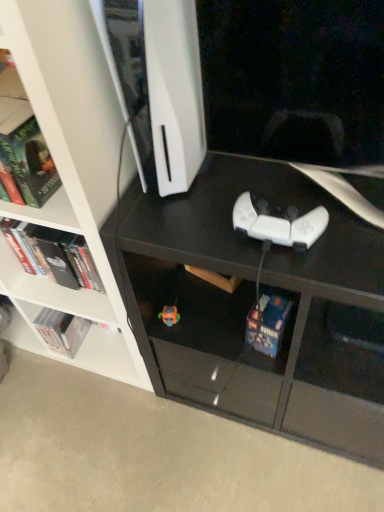
Question: Is hardcover book at lower center, arranged as the first book when viewed from the front, placed right next to translucent orange toy at lower center?

Choices:
 (A) no
 (B) yes

Answer: (A)

Question: Is hardcover book at lower center, which is counted as the third book, starting from the left, bigger than translucent orange toy at lower center?

Choices:
 (A) no
 (B) yes

Answer: (B)

Question: Is hardcover book at lower center, marked as the 3th book in a back-to-front arrangement, located outside translucent orange toy at lower center?

Choices:
 (A) yes
 (B) no

Answer: (A)

Question: From the image's perspective, does hardcover book at lower center, arranged as the first book when viewed from the front, appear lower than translucent orange toy at lower center?

Choices:
 (A) yes
 (B) no

Answer: (A)

Question: Can translucent orange toy at lower center be found inside hardcover book at lower center, which ranks as the first book in right-to-left order?

Choices:
 (A) no
 (B) yes

Answer: (A)

Question: Looking at their shapes, would you say white matte game controller at center is wider or thinner than white matte bookshelf at upper left?

Choices:
 (A) wide
 (B) thin

Answer: (B)

Question: From their relative heights in the image, would you say white matte game controller at center is taller or shorter than white matte bookshelf at upper left?

Choices:
 (A) short
 (B) tall

Answer: (A)

Question: Is white matte game controller at center in front of or behind white matte bookshelf at upper left in the image?

Choices:
 (A) front
 (B) behind

Answer: (B)

Question: From the image's perspective, is white matte game controller at center above or below white matte bookshelf at upper left?

Choices:
 (A) above
 (B) below

Answer: (B)

Question: Is hardcover book at lower center, arranged as the first book when viewed from the front, inside the boundaries of white matte game controller at center, or outside?

Choices:
 (A) outside
 (B) inside

Answer: (A)

Question: Visually, is hardcover book at lower center, which ranks as the first book in right-to-left order, positioned to the left or to the right of white matte game controller at center?

Choices:
 (A) right
 (B) left

Answer: (A)

Question: In the image, is hardcover book at lower center, which is counted as the third book, starting from the left, positioned in front of or behind white matte game controller at center?

Choices:
 (A) front
 (B) behind

Answer: (B)

Question: Is hardcover book at lower center, marked as the 3th book in a back-to-front arrangement, taller or shorter than white matte game controller at center?

Choices:
 (A) short
 (B) tall

Answer: (B)

Question: Considering their positions, is white matte game controller at center located in front of or behind translucent orange toy at lower center?

Choices:
 (A) front
 (B) behind

Answer: (A)

Question: From a real-world perspective, is white matte game controller at center above or below translucent orange toy at lower center?

Choices:
 (A) below
 (B) above

Answer: (B)